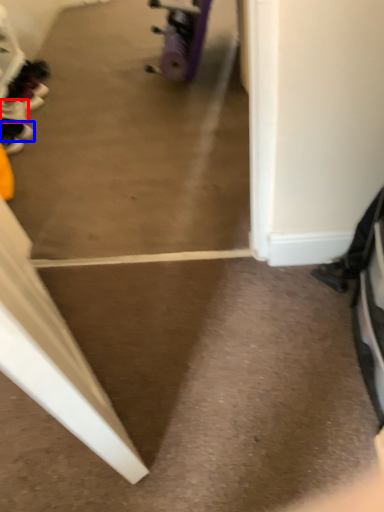
Question: Among these objects, which one is nearest to the camera, footwear (highlighted by a red box) or footwear (highlighted by a blue box)?

Choices:
 (A) footwear
 (B) footwear

Answer: (B)